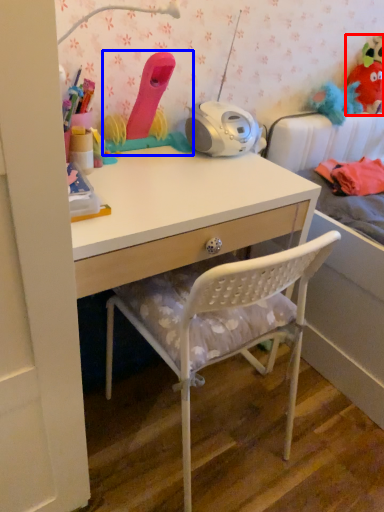
Question: Which object appears closest to the camera in this image, toy (highlighted by a red box) or toy (highlighted by a blue box)?

Choices:
 (A) toy
 (B) toy

Answer: (B)